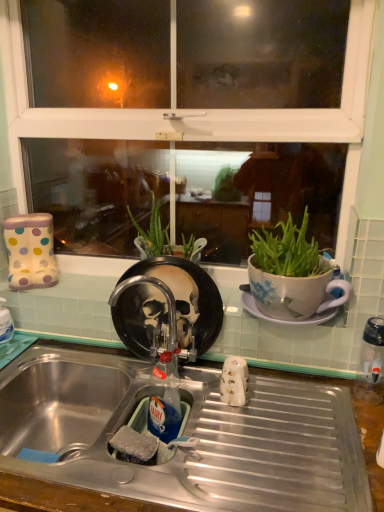
You are a GUI agent. You are given a task and a screenshot of the screen. Output one action in this format:
    pyautogui.click(x=<x>, y=<y>)
    Task: Click on the clear plastic water bottle at right
    The image size is (384, 512).
    Given the screenshot: What is the action you would take?
    pyautogui.click(x=371, y=362)

Identify the location of white ceramic saucer at right. (285, 320).

Can you confirm if rubber sponge at sink is smaller than metallic faucet at center?

Yes, rubber sponge at sink is smaller than metallic faucet at center.

Considering the points (136, 457) and (194, 310), which point is behind, point (136, 457) or point (194, 310)?

Positioned behind is point (194, 310).

Based on the photo, looking at their sizes, would you say rubber sponge at sink is wider or thinner than metallic faucet at center?

Considering their sizes, rubber sponge at sink looks slimmer than metallic faucet at center.

In the scene shown: Does rubber sponge at sink appear on the right side of metallic faucet at center?

No, rubber sponge at sink is not to the right of metallic faucet at center.

Does white ceramic saucer at right have a smaller size compared to translucent plastic bottle at sink?

Incorrect, white ceramic saucer at right is not smaller in size than translucent plastic bottle at sink.

Do you think white ceramic saucer at right is within translucent plastic bottle at sink, or outside of it?

white ceramic saucer at right cannot be found inside translucent plastic bottle at sink.

Between point (261, 318) and point (180, 413), which one is positioned in front?

Point (180, 413)

Can you tell me how much metallic faucet at center and white ceramic saucer at right differ in facing direction?

The angular difference between metallic faucet at center and white ceramic saucer at right is 0.433 degrees.

From a real-world perspective, is metallic faucet at center above or below white ceramic saucer at right?

metallic faucet at center is situated lower than white ceramic saucer at right in the real world.

Is metallic faucet at center wider or thinner than white ceramic saucer at right?

In the image, metallic faucet at center appears to be more narrow than white ceramic saucer at right.

Is point (130, 452) farther from camera compared to point (175, 431)?

No, (130, 452) is in front of (175, 431).

Is rubber sponge at sink shorter than translucent plastic bottle at sink?

Indeed, rubber sponge at sink has a lesser height compared to translucent plastic bottle at sink.

From the picture: Considering the sizes of objects rubber sponge at sink and translucent plastic bottle at sink in the image provided, who is bigger, rubber sponge at sink or translucent plastic bottle at sink?

With larger size is translucent plastic bottle at sink.

Consider the image. Is rubber sponge at sink far from translucent plastic bottle at sink?

Actually, rubber sponge at sink and translucent plastic bottle at sink are a little close together.

Do you think metallic faucet at center is within translucent plastic bottle at sink, or outside of it?

metallic faucet at center is spatially situated outside translucent plastic bottle at sink.

Is metallic faucet at center oriented away from translucent plastic bottle at sink?

No, metallic faucet at center's orientation is not away from translucent plastic bottle at sink.

Considering the sizes of objects metallic faucet at center and translucent plastic bottle at sink in the image provided, who is bigger, metallic faucet at center or translucent plastic bottle at sink?

With larger size is metallic faucet at center.

Find the location of a particular element. bottle that is in front of the metallic faucet at center is located at coordinates (166, 399).

Can you tell me how much translucent plastic bottle at sink and clear plastic water bottle at right differ in facing direction?

35.2 degrees.

From a real-world perspective, who is located higher, translucent plastic bottle at sink or clear plastic water bottle at right?

In real-world perspective, clear plastic water bottle at right is above.

Which of these two, translucent plastic bottle at sink or clear plastic water bottle at right, is thinner?

translucent plastic bottle at sink.

Where is `appliance that appears above the translucent plastic bottle at sink (from a real-world perspective)`? The width and height of the screenshot is (384, 512). appliance that appears above the translucent plastic bottle at sink (from a real-world perspective) is located at coordinates (371, 362).

Which is more distant, (371, 391) or (115, 447)?

The point (371, 391) is more distant.

Is clear plastic water bottle at right surrounding rubber sponge at sink?

No, rubber sponge at sink is not a part of clear plastic water bottle at right.

Considering the sizes of clear plastic water bottle at right and rubber sponge at sink in the image, is clear plastic water bottle at right taller or shorter than rubber sponge at sink?

Considering their sizes, clear plastic water bottle at right has more height than rubber sponge at sink.

Considering the positions of objects clear plastic water bottle at right and rubber sponge at sink in the image provided, who is more to the right, clear plastic water bottle at right or rubber sponge at sink?

Positioned to the right is clear plastic water bottle at right.

I want to click on faucet that is above the rubber sponge at sink (from a real-world perspective), so click(157, 311).

Where is `saucer behind the translucent plastic bottle at sink`? The width and height of the screenshot is (384, 512). saucer behind the translucent plastic bottle at sink is located at coordinates (285, 320).

Considering their positions, is metallic stainless steel sink at lower center positioned further to metallic faucet at center than rubber sponge at sink?

rubber sponge at sink is positioned further to the anchor metallic faucet at center.

Considering their positions, is white ceramic saucer at right positioned closer to translucent plastic bottle at sink than rubber sponge at sink?

The object closer to translucent plastic bottle at sink is rubber sponge at sink.

When comparing their distances from clear plastic water bottle at right, does rubber sponge at sink or metallic stainless steel sink at lower center seem further?

Based on the image, rubber sponge at sink appears to be further to clear plastic water bottle at right.

When comparing their distances from clear plastic water bottle at right, does white ceramic saucer at right or metallic faucet at center seem further?

metallic faucet at center lies further to clear plastic water bottle at right than the other object.

Considering their positions, is clear plastic water bottle at right positioned further to translucent plastic bottle at sink than white ceramic saucer at right?

Based on the image, clear plastic water bottle at right appears to be further to translucent plastic bottle at sink.

Estimate the real-world distances between objects in this image. Which object is closer to rubber sponge at sink, metallic stainless steel sink at lower center or white ceramic saucer at right?

The object closer to rubber sponge at sink is metallic stainless steel sink at lower center.

Which object lies nearer to the anchor point metallic faucet at center, translucent plastic bottle at sink or metallic stainless steel sink at lower center?

The object closer to metallic faucet at center is translucent plastic bottle at sink.

Which object lies further to the anchor point translucent plastic bottle at sink, metallic stainless steel sink at lower center or clear plastic water bottle at right?

clear plastic water bottle at right lies further to translucent plastic bottle at sink than the other object.

Locate an element on the screen. The width and height of the screenshot is (384, 512). faucet located between metallic stainless steel sink at lower center and clear plastic water bottle at right in the left-right direction is located at coordinates pyautogui.click(x=157, y=311).

At what (x,y) coordinates should I click in order to perform the action: click on food between metallic faucet at center and metallic stainless steel sink at lower center from top to bottom. Please return your answer as a coordinate pair (x, y). The height and width of the screenshot is (512, 384). Looking at the image, I should click on (134, 446).

Where is `saucer situated between metallic faucet at center and clear plastic water bottle at right from left to right`? saucer situated between metallic faucet at center and clear plastic water bottle at right from left to right is located at coordinates (285, 320).

Locate an element on the screen. saucer located between rubber sponge at sink and clear plastic water bottle at right in the left-right direction is located at coordinates (285, 320).